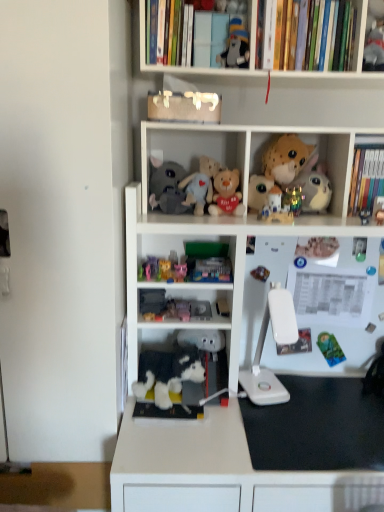
Question: From the image's perspective, would you say pink plush toy at center, the 8th toy in the top-to-bottom sequence, is positioned over fluffy gray plush at center, arranged as the 3th toy when viewed from the top?

Choices:
 (A) no
 (B) yes

Answer: (A)

Question: Is fluffy gray plush at center, which ranks as the 9th toy in bottom-to-top order, surrounded by pink plush toy at center, the fourth toy ordered from the bottom?

Choices:
 (A) yes
 (B) no

Answer: (B)

Question: Is pink plush toy at center, the 8th toy in the top-to-bottom sequence, shorter than fluffy gray plush at center, which ranks as the 9th toy in bottom-to-top order?

Choices:
 (A) yes
 (B) no

Answer: (A)

Question: Is pink plush toy at center, the 8th toy in the top-to-bottom sequence, to the right of fluffy gray plush at center, arranged as the 3th toy when viewed from the top, from the viewer's perspective?

Choices:
 (A) no
 (B) yes

Answer: (B)

Question: Is pink plush toy at center, the fourth toy ordered from the bottom, next to fluffy gray plush at center, arranged as the 3th toy when viewed from the top?

Choices:
 (A) yes
 (B) no

Answer: (B)

Question: Is the depth of pink plush toy at center, the fourth toy ordered from the bottom, less than that of fluffy gray plush at center, arranged as the 3th toy when viewed from the top?

Choices:
 (A) no
 (B) yes

Answer: (B)

Question: Does matte black plush at upper center, which ranks as the eleventh toy in bottom-to-top order, lie behind pink plush toy at center, the 8th toy in the top-to-bottom sequence?

Choices:
 (A) no
 (B) yes

Answer: (A)

Question: From a real-world perspective, is matte black plush at upper center, arranged as the first toy when viewed from the top, under pink plush toy at center, the 8th toy in the top-to-bottom sequence?

Choices:
 (A) yes
 (B) no

Answer: (B)

Question: Can you see matte black plush at upper center, arranged as the first toy when viewed from the top, touching pink plush toy at center, the fourth toy ordered from the bottom?

Choices:
 (A) no
 (B) yes

Answer: (A)

Question: From the image's perspective, would you say matte black plush at upper center, which ranks as the eleventh toy in bottom-to-top order, is shown under pink plush toy at center, the 8th toy in the top-to-bottom sequence?

Choices:
 (A) yes
 (B) no

Answer: (B)

Question: Does matte black plush at upper center, which ranks as the eleventh toy in bottom-to-top order, come in front of pink plush toy at center, the fourth toy ordered from the bottom?

Choices:
 (A) yes
 (B) no

Answer: (A)

Question: Is matte black plush at upper center, arranged as the first toy when viewed from the top, thinner than pink plush toy at center, the fourth toy ordered from the bottom?

Choices:
 (A) yes
 (B) no

Answer: (B)

Question: Is white plush toy at center, which ranks as the eleventh toy in top-to-bottom order, at the back of spotted plush toy at upper right, the 10th toy when ordered from bottom to top?

Choices:
 (A) no
 (B) yes

Answer: (A)